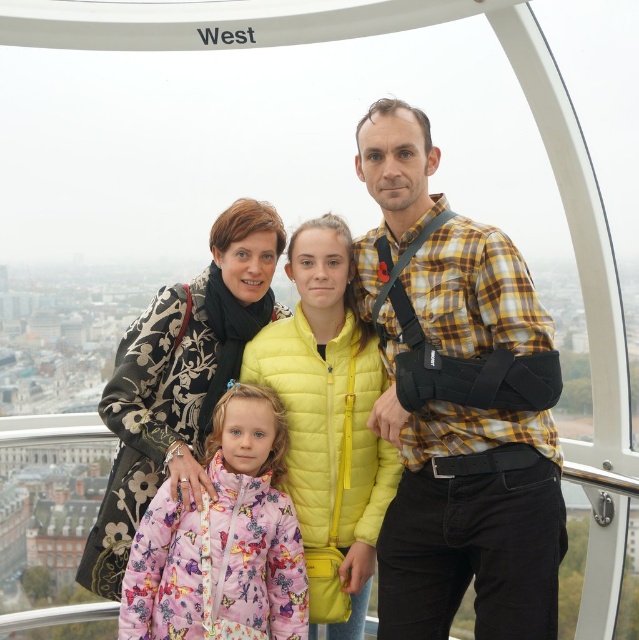
Is point (412, 144) closer to viewer compared to point (491, 564)?

No, it is behind (491, 564).

In the scene shown: Which is above, yellow quilted jacket at center or yellow plaid shirt at center?

yellow plaid shirt at center is higher up.

In order to click on yellow quilted jacket at center in this screenshot , I will do `click(458, 403)`.

The height and width of the screenshot is (640, 639). What do you see at coordinates (458, 403) in the screenshot?
I see `yellow quilted jacket at center` at bounding box center [458, 403].

Between point (396, 531) and point (265, 600), which one is positioned behind?

Positioned behind is point (396, 531).

I want to click on yellow quilted jacket at center, so click(458, 403).

Between yellow plaid shirt at center and pink quilted jacket at lower left, which one has more height?

yellow plaid shirt at center is taller.

Between yellow plaid shirt at center and pink quilted jacket at lower left, which one appears on the right side from the viewer's perspective?

Positioned to the right is yellow plaid shirt at center.

Where is `yellow plaid shirt at center`? yellow plaid shirt at center is located at coordinates coord(458,403).